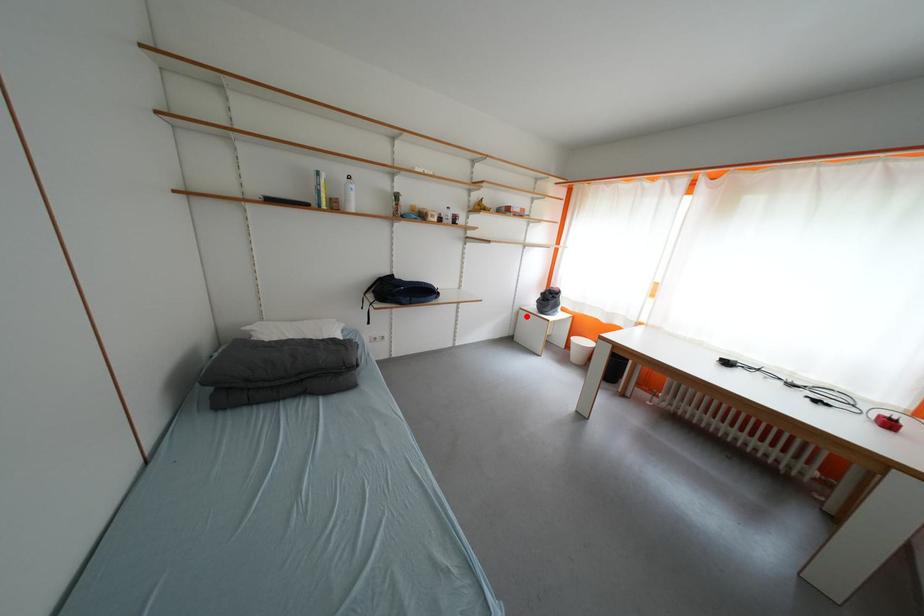
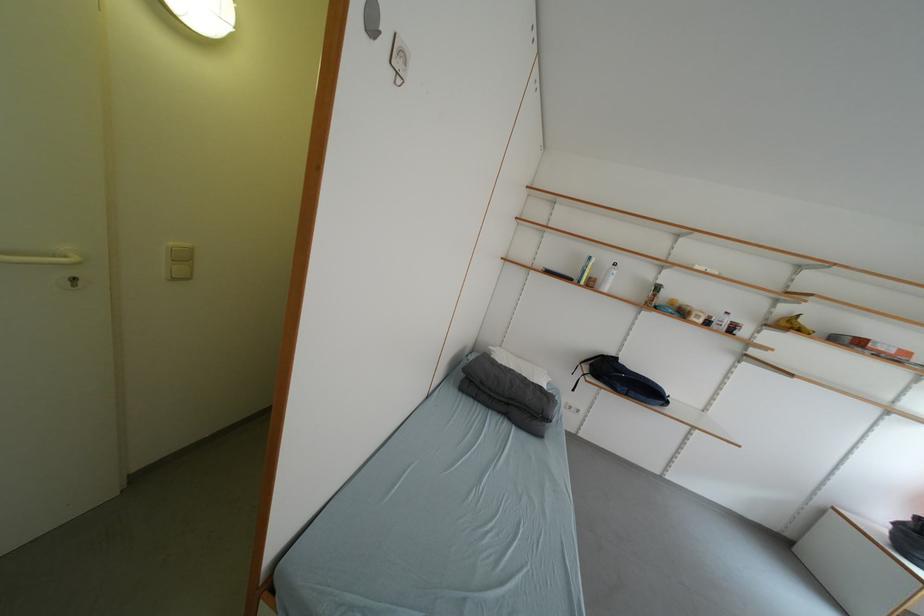
Where in the second image is the point corresponding to the highlighted location from the first image?

(832, 515)